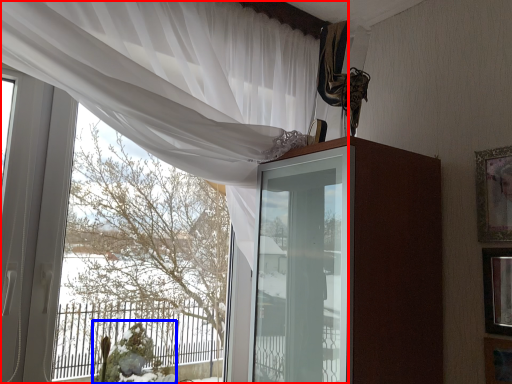
Question: Which object appears closest to the camera in this image, curtain (highlighted by a red box) or floral arrangement (highlighted by a blue box)?

Choices:
 (A) curtain
 (B) floral arrangement

Answer: (A)